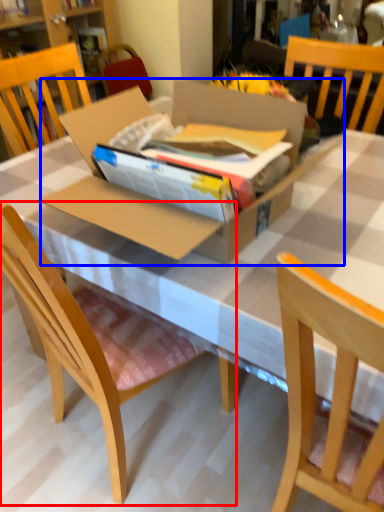
Question: Which point is further to the camera, chair (highlighted by a red box) or cardboard box (highlighted by a blue box)?

Choices:
 (A) chair
 (B) cardboard box

Answer: (B)